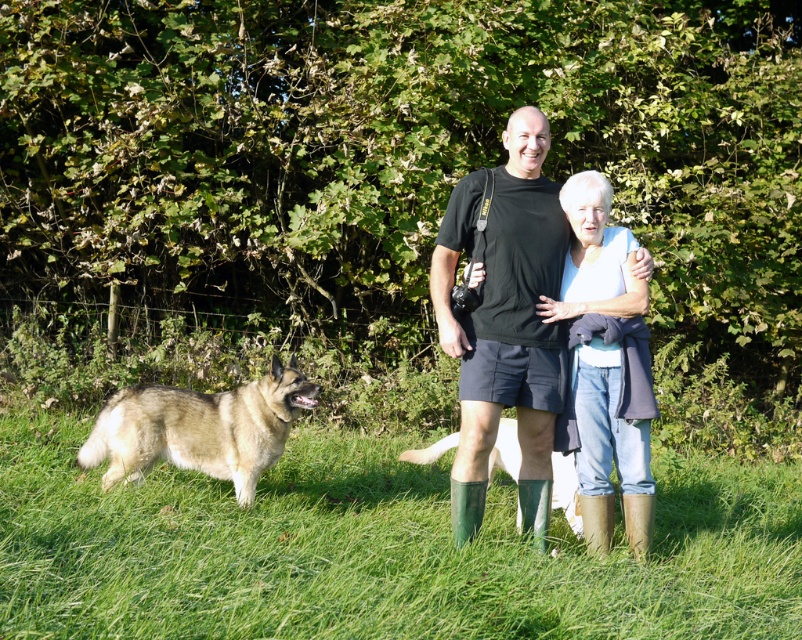
Question: From the image, what is the correct spatial relationship of green grass at lower center in relation to brown fur dog at center?

Choices:
 (A) left
 (B) right

Answer: (A)

Question: Which object appears farthest from the camera in this image?

Choices:
 (A) fuzzy beige dog at lower left
 (B) green grass at lower center
 (C) black matte t-shirt at center
 (D) denim jeans at center

Answer: (A)

Question: Does green grass at lower center appear under black matte t-shirt at center?

Choices:
 (A) no
 (B) yes

Answer: (B)

Question: Among these objects, which one is farthest from the camera?

Choices:
 (A) green grass at lower center
 (B) denim jeans at center

Answer: (B)

Question: Which of the following is the farthest from the observer?

Choices:
 (A) green grass at lower center
 (B) fuzzy beige dog at lower left
 (C) denim jeans at center

Answer: (B)

Question: From the image, what is the correct spatial relationship of black matte t-shirt at center in relation to brown fur dog at center?

Choices:
 (A) above
 (B) below

Answer: (A)